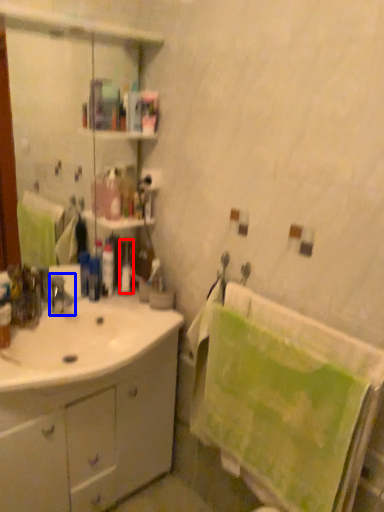
Question: Which object appears farthest to the camera in this image, toiletry (highlighted by a red box) or tap (highlighted by a blue box)?

Choices:
 (A) toiletry
 (B) tap

Answer: (A)